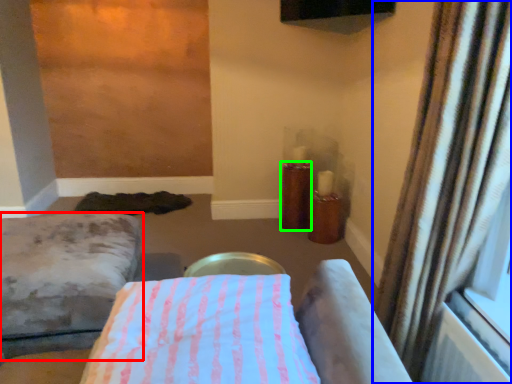
Question: Which object is the closest to the furniture (highlighted by a red box)? Choose among these: curtain (highlighted by a blue box) or candle holder (highlighted by a green box).

Choices:
 (A) curtain
 (B) candle holder

Answer: (A)